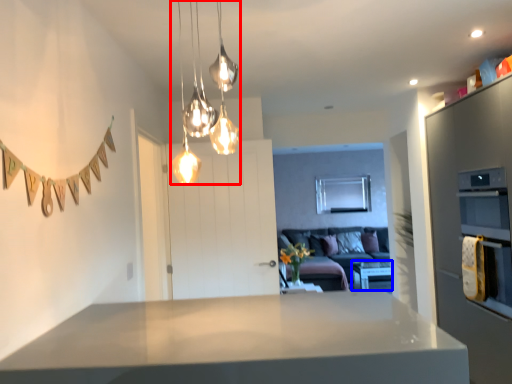
Question: Which object is closer to the camera taking this photo, lamp (highlighted by a red box) or table (highlighted by a blue box)?

Choices:
 (A) lamp
 (B) table

Answer: (A)